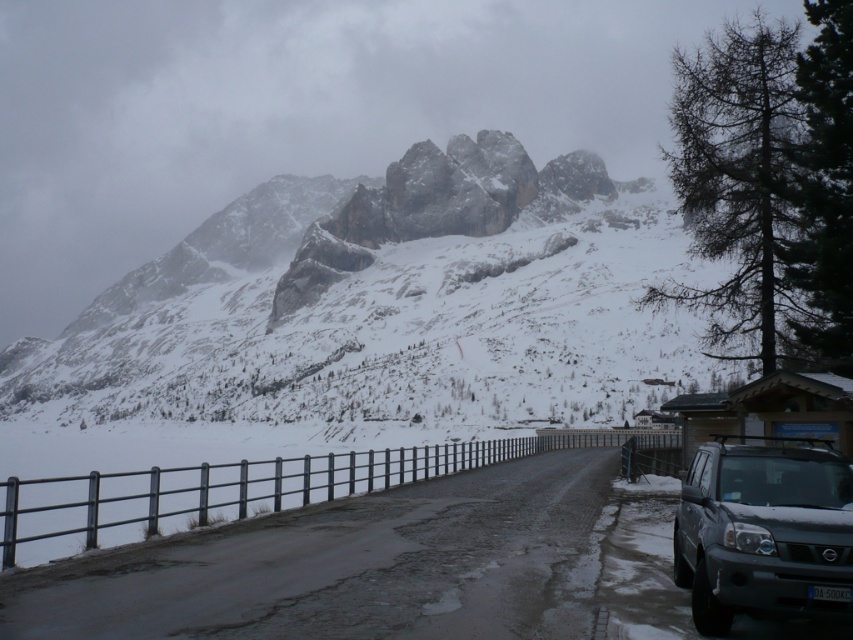
You are driving a car and want to park near the snowy granite mountain at upper center. However, there is a silver metallic suv at right blocking the path. Based on the scene, can you determine if the suv is in your way?

The snowy granite mountain at upper center is positioned over the silver metallic suv at right, meaning the suv is directly below the mountain in the image. Since the suv is parked on the road leading to the mountain base, it would be blocking your path to park there.

In the scene shown: You are standing at the point marked by the coordinates point [386,301]. Looking around, what major landscape feature do you see directly in front of you?

The point [386,301] indicates snowy granite mountain at upper center, so directly in front of you is the snowy granite mountain at upper center.

You are driving a car and want to park it near the silver metallic suv at right. According to the scene description, where should you position your car relative to the smooth asphalt road at center?

The smooth asphalt road at center is positioned on the left side of the silver metallic suv at right, so you should park your car to the left of the smooth asphalt road at center to be near the silver metallic suv at right.